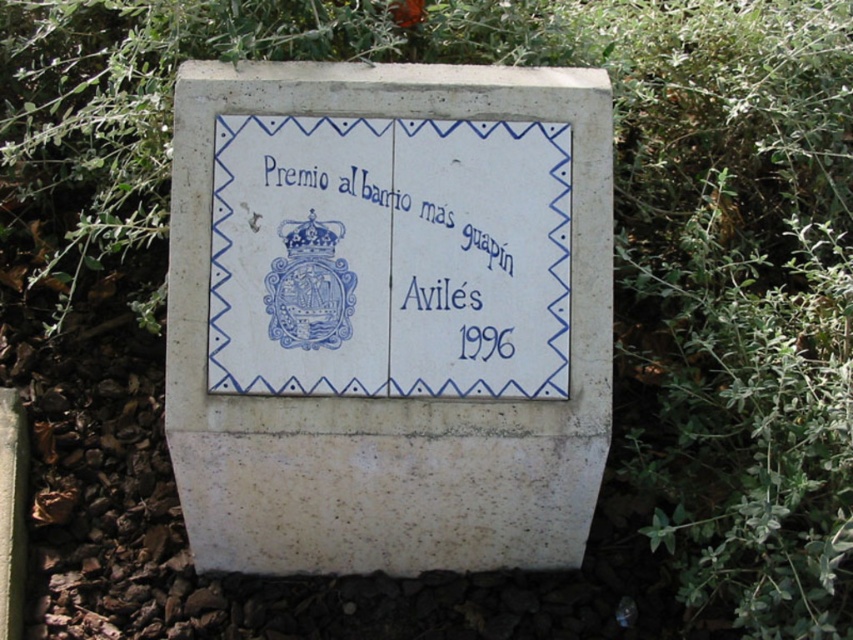
Find the location of a particular element. This screenshot has width=853, height=640. white stone plaque at center is located at coordinates (387, 314).

Does white stone plaque at center have a lesser width compared to blue ceramic tile at center?

In fact, white stone plaque at center might be wider than blue ceramic tile at center.

Which is in front, point (368, 348) or point (345, 285)?

Point (368, 348)

The image size is (853, 640). I want to click on white stone plaque at center, so click(x=387, y=314).